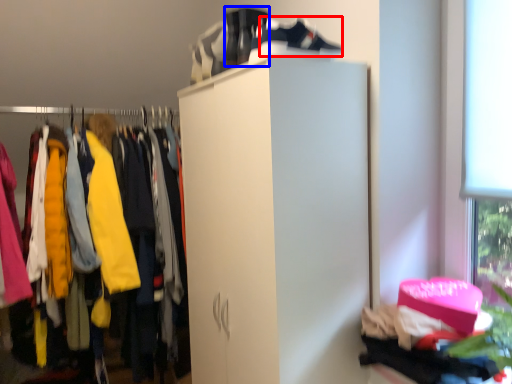
Question: Among these objects, which one is farthest to the camera, shoe (highlighted by a red box) or running shoe (highlighted by a blue box)?

Choices:
 (A) shoe
 (B) running shoe

Answer: (B)